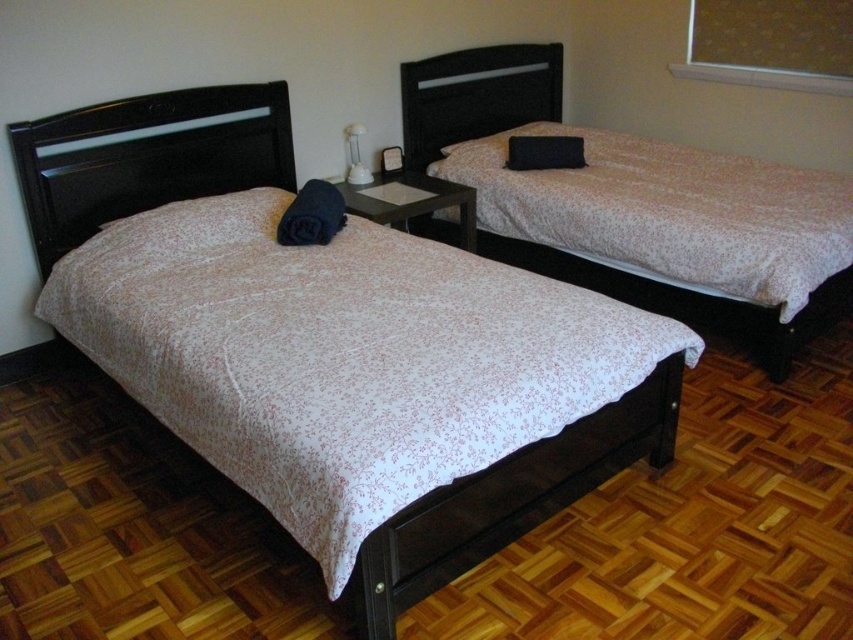
Question: Where is black matte pillow at upper right located in relation to white glossy lamp at center in the image?

Choices:
 (A) right
 (B) left

Answer: (A)

Question: Which point appears closest to the camera in this image?

Choices:
 (A) (357, 156)
 (B) (556, 150)
 (C) (793, 332)
 (D) (624, 401)

Answer: (D)

Question: Which of the following is the farthest from the observer?

Choices:
 (A) white floral fabric bed at left
 (B) white glossy lamp at center
 (C) white floral fabric bed at center
 (D) black matte pillow at upper right

Answer: (D)

Question: Is white floral fabric bed at left smaller than white glossy lamp at center?

Choices:
 (A) yes
 (B) no

Answer: (B)

Question: Among these points, which one is nearest to the camera?

Choices:
 (A) (264, 148)
 (B) (643, 305)
 (C) (363, 182)
 (D) (515, 163)

Answer: (B)

Question: Observing the image, what is the correct spatial positioning of black matte pillow at upper right in reference to white glossy lamp at center?

Choices:
 (A) below
 (B) above

Answer: (B)